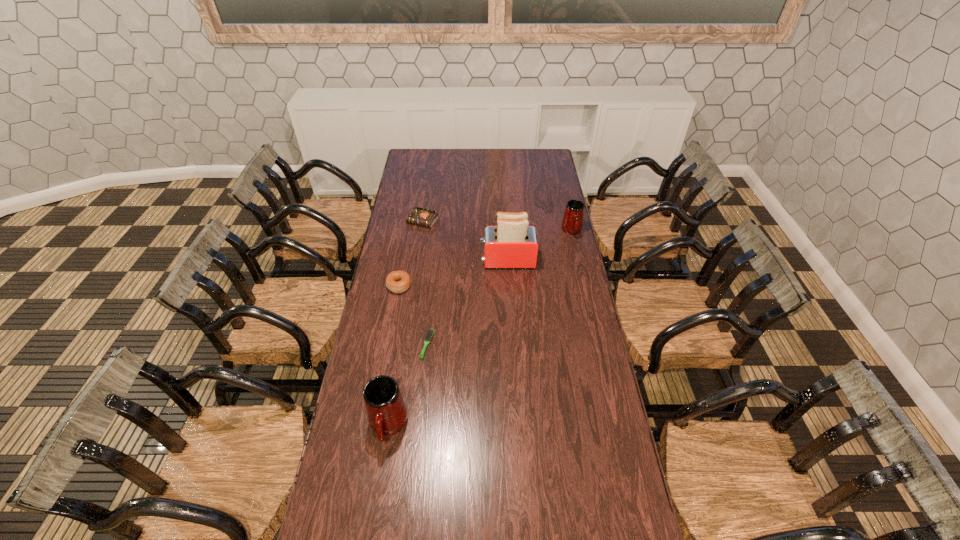
At what (x,y) coordinates should I click in order to perform the action: click on vacant spot for a new mug to ensure equal spacing. Please return your answer as a coordinate pair (x, y). Looking at the image, I should click on (x=498, y=309).